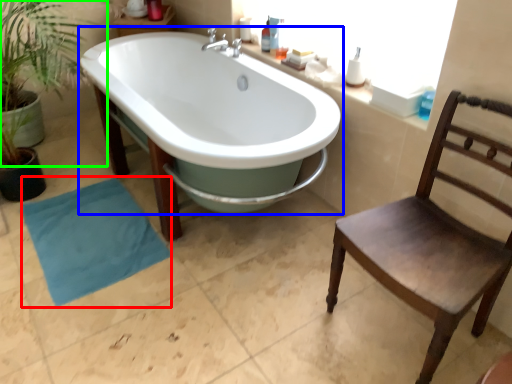
Question: Estimate the real-world distances between objects in this image. Which object is closer to beach towel (highlighted by a red box), bathtub (highlighted by a blue box) or vegetation (highlighted by a green box)?

Choices:
 (A) bathtub
 (B) vegetation

Answer: (A)